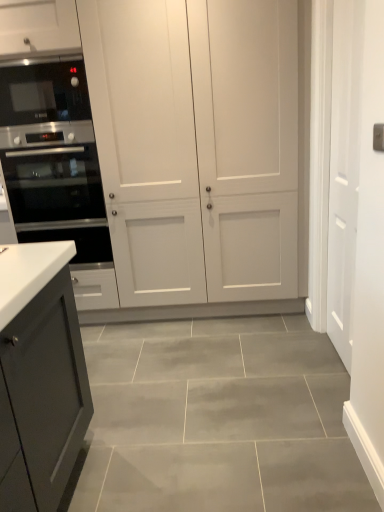
Question: Is white matte cabinet at center oriented towards satin black oven at left?

Choices:
 (A) no
 (B) yes

Answer: (B)

Question: From a real-world perspective, is white matte cabinet at center physically below satin black oven at left?

Choices:
 (A) yes
 (B) no

Answer: (B)

Question: From the image's perspective, is white matte cabinet at center above satin black oven at left?

Choices:
 (A) yes
 (B) no

Answer: (A)

Question: Does white matte cabinet at center appear on the right side of satin black oven at left?

Choices:
 (A) no
 (B) yes

Answer: (B)

Question: From a real-world perspective, is white matte cabinet at center positioned over satin black oven at left based on gravity?

Choices:
 (A) no
 (B) yes

Answer: (B)

Question: Is white matte cabinet at center not inside satin black oven at left?

Choices:
 (A) yes
 (B) no

Answer: (A)

Question: Can you confirm if black glass microwave at left is bigger than white matte door at right?

Choices:
 (A) yes
 (B) no

Answer: (B)

Question: Is black glass microwave at left wider than white matte door at right?

Choices:
 (A) no
 (B) yes

Answer: (B)

Question: From a real-world perspective, is black glass microwave at left under white matte door at right?

Choices:
 (A) no
 (B) yes

Answer: (A)

Question: Considering the relative sizes of black glass microwave at left and white matte door at right in the image provided, is black glass microwave at left taller than white matte door at right?

Choices:
 (A) yes
 (B) no

Answer: (B)

Question: Does black glass microwave at left have a smaller size compared to white matte door at right?

Choices:
 (A) yes
 (B) no

Answer: (A)

Question: Is black glass microwave at left located outside white matte door at right?

Choices:
 (A) no
 (B) yes

Answer: (B)

Question: From a real-world perspective, is black glass microwave at left positioned under white matte cabinet at center based on gravity?

Choices:
 (A) yes
 (B) no

Answer: (B)